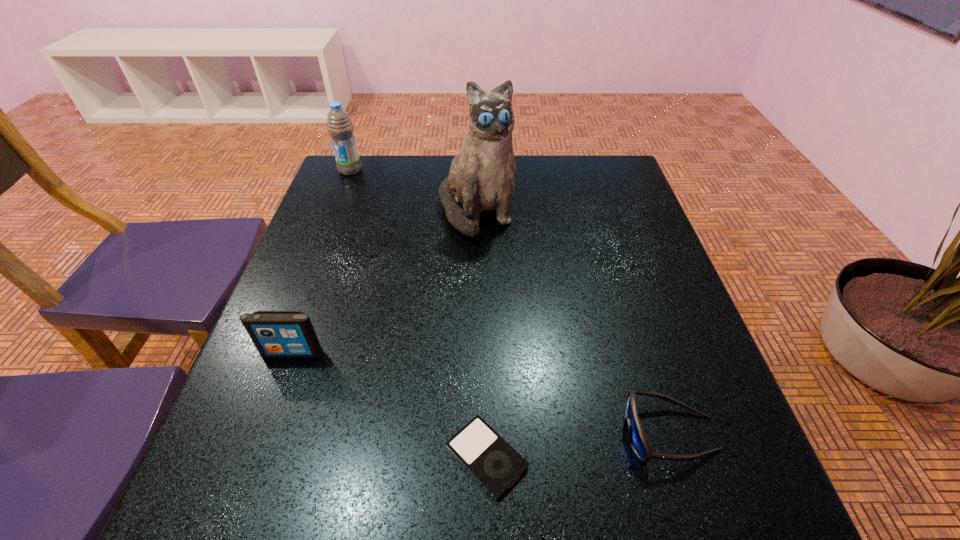
You are a GUI agent. You are given a task and a screenshot of the screen. Output one action in this format:
    pyautogui.click(x=<x>, y=<y>)
    Task: Click on the empty space that is in between the fourth nearest object and the water bottle
    This screenshot has height=540, width=960.
    Given the screenshot: What is the action you would take?
    pyautogui.click(x=414, y=190)

Image resolution: width=960 pixels, height=540 pixels. Identify the location of vacant space that's between the farthest object and the taller iPod. (322, 261).

Locate an element on the screen. unoccupied area between the cat and the second shortest object is located at coordinates (573, 321).

Locate an element on the screen. The width and height of the screenshot is (960, 540). free space between the fourth tallest object and the tallest object is located at coordinates (573, 321).

The height and width of the screenshot is (540, 960). Find the location of `free space between the tallest object and the rightmost object`. free space between the tallest object and the rightmost object is located at coordinates (573, 321).

Where is `free area in between the tallest object and the shorter iPod`? The width and height of the screenshot is (960, 540). free area in between the tallest object and the shorter iPod is located at coordinates (482, 333).

The width and height of the screenshot is (960, 540). I want to click on vacant area that lies between the sunglasses and the third nearest object, so click(x=481, y=393).

The width and height of the screenshot is (960, 540). What are the coordinates of `vacant region between the fourth shortest object and the nearer iPod` in the screenshot? It's located at (419, 313).

Find the location of a particular element. vacant space that's between the left iPod and the nearer iPod is located at coordinates (390, 404).

Image resolution: width=960 pixels, height=540 pixels. What are the coordinates of `vacant area that lies between the second farthest object and the water bottle` in the screenshot? It's located at (414, 190).